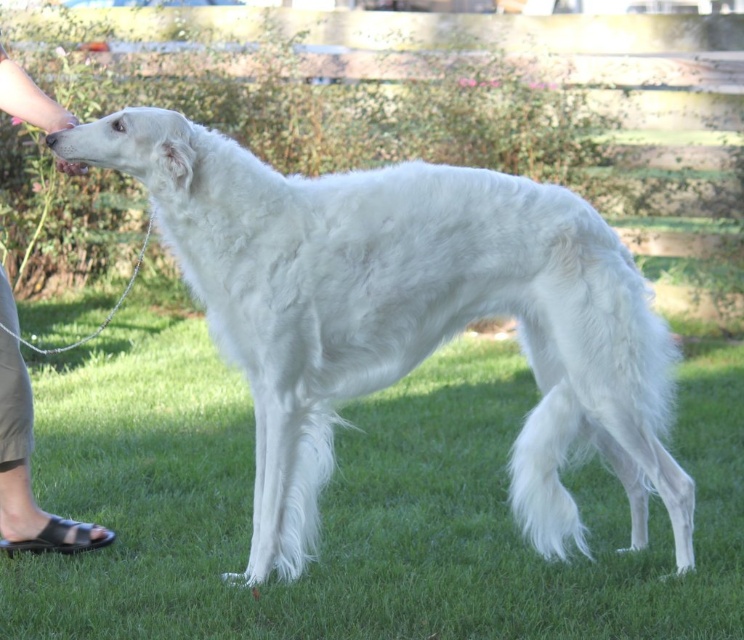
You are a photographer setting up a tripod to take a portrait of the white fluffy dog at center. The tripod requires a minimum of 0.3 meters of space around the dog to avoid obstruction. Based on the dog being at point 0.494, 0.544, will the tripod setup be feasible?

The white fluffy dog at center is located at point (404, 316). Since the tripod requires a minimum of 0.3 meters of space around the dog, and the coordinates indicate the dog is centrally positioned, the setup should be feasible as there is sufficient space around the dog in the frame.

You are a photographer setting up a tripod in the park. You see the white fluffy dog at center and the tan leather sandals at lower left. Which object is bigger in size?

The white fluffy dog at center is larger in size compared to the tan leather sandals at lower left.